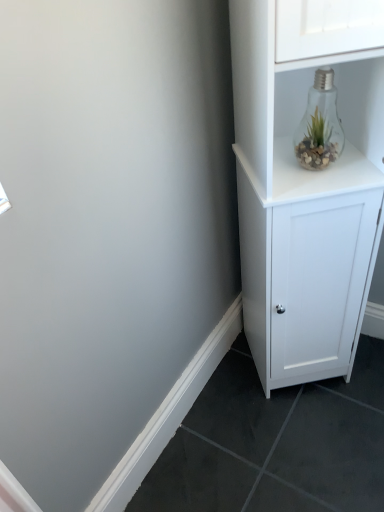
The width and height of the screenshot is (384, 512). Describe the element at coordinates (320, 125) in the screenshot. I see `clear glass light bulb at upper right` at that location.

Find the location of `clear glass light bulb at upper right`. clear glass light bulb at upper right is located at coordinates (320, 125).

What do you see at coordinates (306, 187) in the screenshot? The width and height of the screenshot is (384, 512). I see `white matte cabinet at upper right` at bounding box center [306, 187].

This screenshot has width=384, height=512. I want to click on white matte cabinet at upper right, so click(x=306, y=187).

Identify the location of clear glass light bulb at upper right. The height and width of the screenshot is (512, 384). (320, 125).

Visually, is clear glass light bulb at upper right positioned to the left or to the right of white matte cabinet at upper right?

clear glass light bulb at upper right is positioned on white matte cabinet at upper right's left side.

Is clear glass light bulb at upper right closer to camera compared to white matte cabinet at upper right?

That is False.

Considering the points (328, 98) and (336, 9), which point is in front, point (328, 98) or point (336, 9)?

The point (336, 9) is in front.

From the image's perspective, does clear glass light bulb at upper right appear higher than white matte cabinet at upper right?

Yes.

From a real-world perspective, is clear glass light bulb at upper right above or below white matte cabinet at upper right?

clear glass light bulb at upper right is situated higher than white matte cabinet at upper right in the real world.

Is clear glass light bulb at upper right wider or thinner than white matte cabinet at upper right?

Clearly, clear glass light bulb at upper right has less width compared to white matte cabinet at upper right.

Looking at this image, is clear glass light bulb at upper right taller than white matte cabinet at upper right?

No.

Can you confirm if clear glass light bulb at upper right is bigger than white matte cabinet at upper right?

No, clear glass light bulb at upper right is not bigger than white matte cabinet at upper right.

Is clear glass light bulb at upper right completely or partially outside of white matte cabinet at upper right?

That's incorrect, clear glass light bulb at upper right is not completely outside white matte cabinet at upper right.

Is clear glass light bulb at upper right next to white matte cabinet at upper right and touching it?

No, clear glass light bulb at upper right is not beside white matte cabinet at upper right.

Is clear glass light bulb at upper right facing away from white matte cabinet at upper right?

Yes, white matte cabinet at upper right is at the back of clear glass light bulb at upper right.

What's the angular difference between clear glass light bulb at upper right and white matte cabinet at upper right's facing directions?

They differ by 0.692 degrees in their facing directions.

Where is `cupboard below the clear glass light bulb at upper right (from a real-world perspective)`? The image size is (384, 512). cupboard below the clear glass light bulb at upper right (from a real-world perspective) is located at coordinates (306, 187).

Is white matte cabinet at upper right to the right of clear glass light bulb at upper right from the viewer's perspective?

Yes.

From the picture: Does white matte cabinet at upper right lie in front of clear glass light bulb at upper right?

Yes, white matte cabinet at upper right is closer to the viewer.

Is point (252, 301) closer to camera compared to point (303, 144)?

No, (252, 301) is behind (303, 144).

From the picture: From the image's perspective, does white matte cabinet at upper right appear lower than clear glass light bulb at upper right?

Yes, from the image's perspective, white matte cabinet at upper right is below clear glass light bulb at upper right.

From a real-world perspective, is white matte cabinet at upper right positioned above or below clear glass light bulb at upper right?

From a real-world perspective, white matte cabinet at upper right is physically below clear glass light bulb at upper right.

In terms of width, does white matte cabinet at upper right look wider or thinner when compared to clear glass light bulb at upper right?

white matte cabinet at upper right is wider than clear glass light bulb at upper right.

Considering the relative sizes of white matte cabinet at upper right and clear glass light bulb at upper right in the image provided, is white matte cabinet at upper right shorter than clear glass light bulb at upper right?

No, white matte cabinet at upper right is not shorter than clear glass light bulb at upper right.

Is white matte cabinet at upper right bigger than clear glass light bulb at upper right?

Yes, white matte cabinet at upper right is bigger than clear glass light bulb at upper right.

Choose the correct answer: Is white matte cabinet at upper right inside clear glass light bulb at upper right or outside it?

white matte cabinet at upper right is spatially situated outside clear glass light bulb at upper right.

Is the surface of white matte cabinet at upper right in direct contact with clear glass light bulb at upper right?

No, white matte cabinet at upper right is not in contact with clear glass light bulb at upper right.

Is white matte cabinet at upper right looking in the opposite direction of clear glass light bulb at upper right?

Yes.

You are a GUI agent. You are given a task and a screenshot of the screen. Output one action in this format:
    pyautogui.click(x=<x>, y=<y>)
    Task: Click on the glass vase that appears above the white matte cabinet at upper right (from a real-world perspective)
    
    Given the screenshot: What is the action you would take?
    pyautogui.click(x=320, y=125)

I want to click on glass vase that is behind the white matte cabinet at upper right, so click(320, 125).

Find the location of a particular element. Image resolution: width=384 pixels, height=512 pixels. cupboard below the clear glass light bulb at upper right (from the image's perspective) is located at coordinates (306, 187).